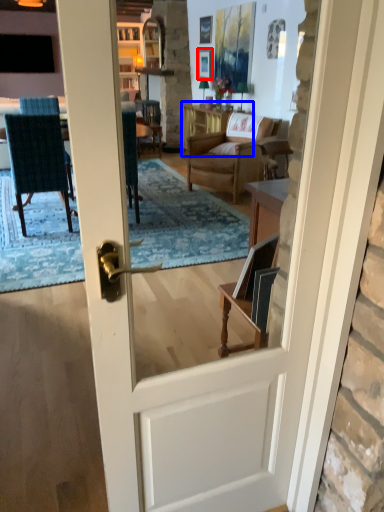
Question: Among these objects, which one is nearest to the camera, picture frame (highlighted by a red box) or table (highlighted by a blue box)?

Choices:
 (A) picture frame
 (B) table

Answer: (B)